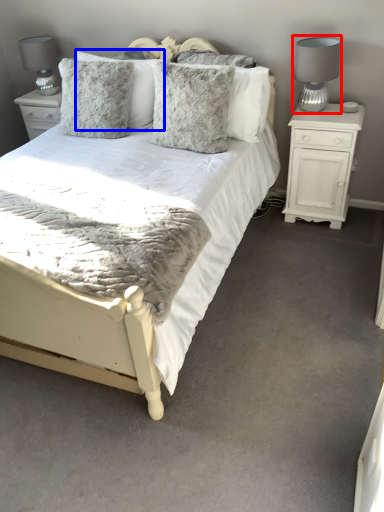
Question: Among these objects, which one is farthest to the camera, table lamp (highlighted by a red box) or pillow (highlighted by a blue box)?

Choices:
 (A) table lamp
 (B) pillow

Answer: (B)